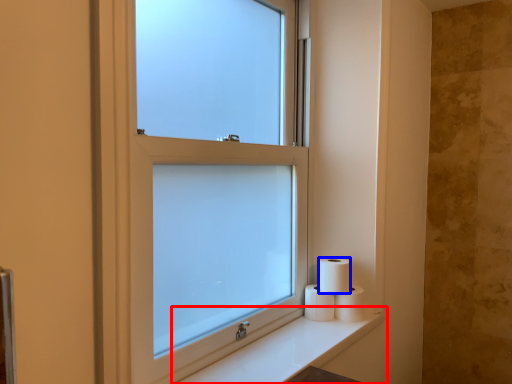
Question: Which of the following is the farthest to the observer, counter top (highlighted by a red box) or toilet paper (highlighted by a blue box)?

Choices:
 (A) counter top
 (B) toilet paper

Answer: (B)